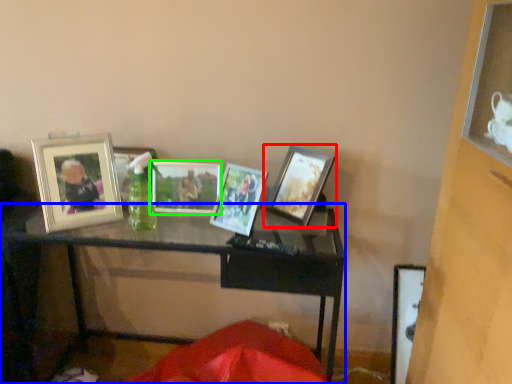
Question: Which is nearer to the picture frame (highlighted by a red box)? table (highlighted by a blue box) or picture frame (highlighted by a green box).

Choices:
 (A) table
 (B) picture frame

Answer: (B)